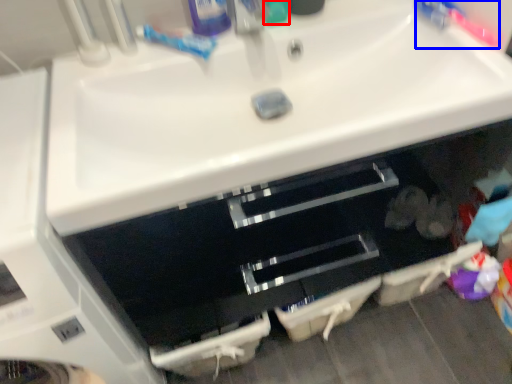
Question: Which object is closer to the camera taking this photo, toiletry (highlighted by a red box) or toothbrush (highlighted by a blue box)?

Choices:
 (A) toiletry
 (B) toothbrush

Answer: (B)